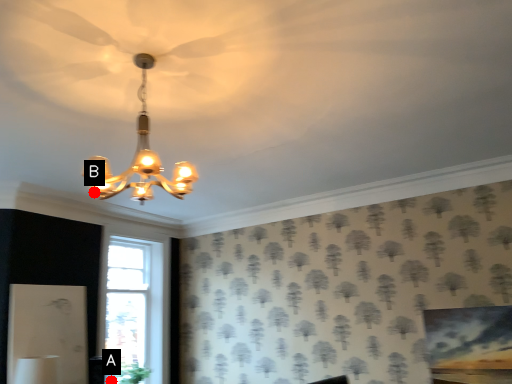
Question: Two points are circled on the image, labeled by A and B beside each circle. Which of the following is the closest to the observer?

Choices:
 (A) A is closer
 (B) B is closer

Answer: (B)